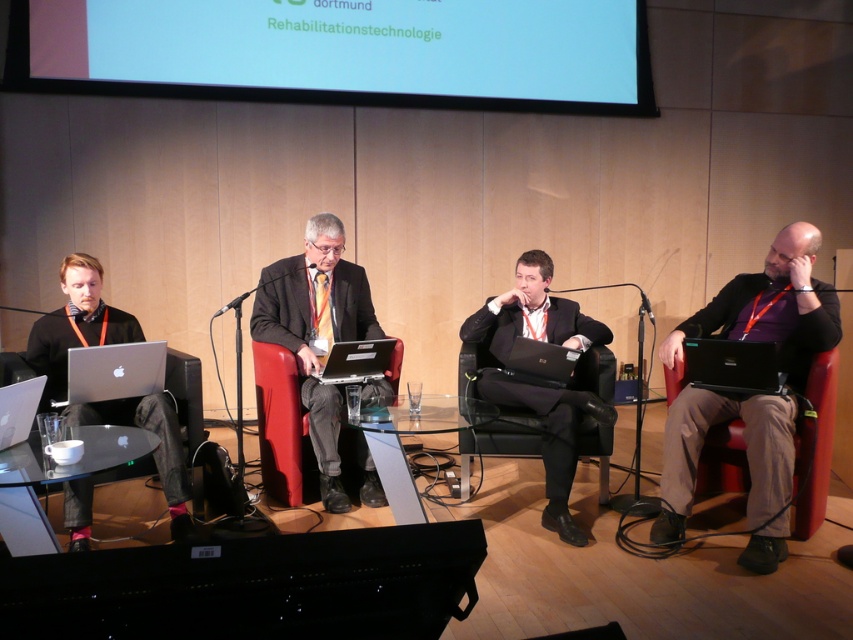
In the scene shown: Does silver metallic laptop at left have a greater width compared to silver metallic laptop at center?

No, silver metallic laptop at left is not wider than silver metallic laptop at center.

Image resolution: width=853 pixels, height=640 pixels. Find the location of `silver metallic laptop at left`. silver metallic laptop at left is located at coordinates (114, 371).

Does point (82, 355) come behind point (393, 344)?

No, it is in front of (393, 344).

Where is `silver metallic laptop at left`? The width and height of the screenshot is (853, 640). silver metallic laptop at left is located at coordinates (114, 371).

Who is lower down, red leather chair at center or black plastic laptop at center?

red leather chair at center

Does point (281, 358) come in front of point (549, 355)?

No.

Identify the location of red leather chair at center. This screenshot has height=640, width=853. (279, 420).

Which is behind, point (740, 444) or point (572, 364)?

The point (572, 364) is more distant.

Is point (699, 497) farther from viewer compared to point (547, 358)?

Yes.

Where is `red leather chair at right`? The image size is (853, 640). red leather chair at right is located at coordinates (x=815, y=445).